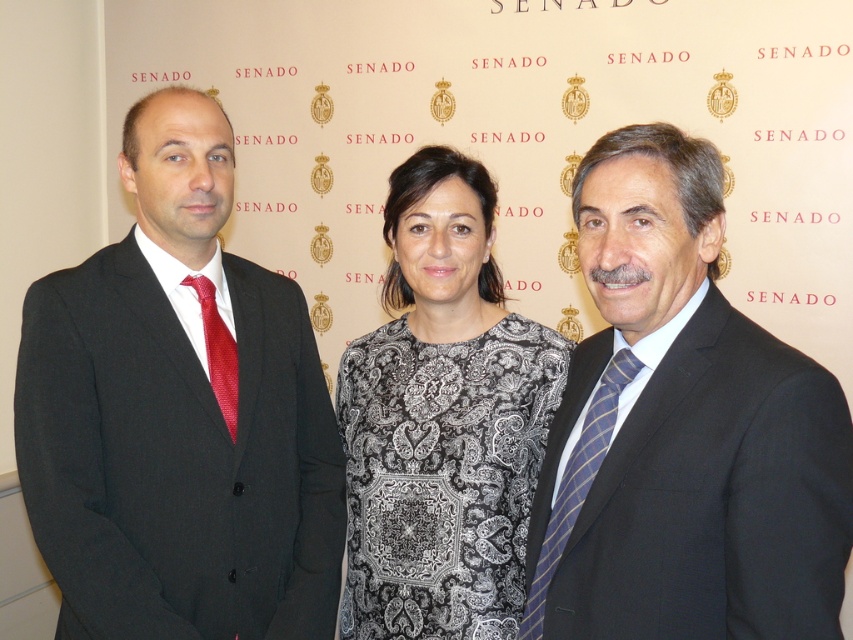
Can you confirm if matte black suit at left is shorter than blue striped tie at right?

No.

Who is higher up, matte black suit at left or blue striped tie at right?

matte black suit at left

Which is in front, point (140, 593) or point (531, 592)?

Point (531, 592)

Identify the location of matte black suit at left. The image size is (853, 640). (178, 413).

Is black lace dress at center below shiny red tie at left?

Yes.

Can you confirm if black lace dress at center is positioned to the left of shiny red tie at left?

In fact, black lace dress at center is to the right of shiny red tie at left.

Is point (357, 586) less distant than point (201, 280)?

No, it is behind (201, 280).

The width and height of the screenshot is (853, 640). I want to click on black lace dress at center, so click(442, 420).

Is matte black suit at left below shiny red tie at left?

Correct, matte black suit at left is located below shiny red tie at left.

Can you confirm if matte black suit at left is positioned to the left of shiny red tie at left?

Yes, matte black suit at left is to the left of shiny red tie at left.

Between point (236, 435) and point (227, 364), which one is positioned in front?

Point (236, 435) is in front.

Locate an element on the screen. The width and height of the screenshot is (853, 640). matte black suit at left is located at coordinates (178, 413).